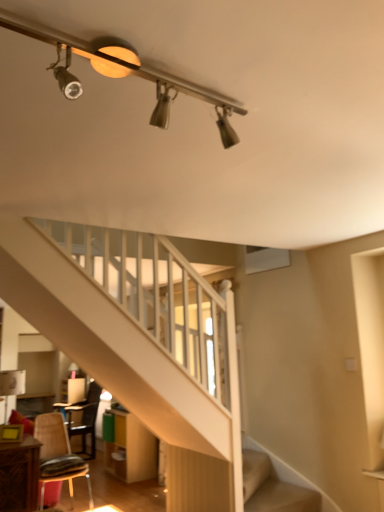
Question: Is metallic brown chair at lower left, which appears as the 1th chair when viewed from the front, turned away from wooden chair at lower left, the 1th chair when ordered from back to front?

Choices:
 (A) no
 (B) yes

Answer: (A)

Question: Is metallic brown chair at lower left, which appears as the 1th chair when viewed from the front, to the right of wooden chair at lower left, the 1th chair when ordered from back to front, from the viewer's perspective?

Choices:
 (A) yes
 (B) no

Answer: (A)

Question: Considering the relative sizes of metallic brown chair at lower left, which is counted as the 2th chair, starting from the back, and wooden chair at lower left, marked as the second chair in a front-to-back arrangement, in the image provided, is metallic brown chair at lower left, which is counted as the 2th chair, starting from the back, smaller than wooden chair at lower left, marked as the second chair in a front-to-back arrangement,?

Choices:
 (A) yes
 (B) no

Answer: (A)

Question: Is metallic brown chair at lower left, which is counted as the 2th chair, starting from the back, at the left side of wooden chair at lower left, the 1th chair when ordered from back to front?

Choices:
 (A) no
 (B) yes

Answer: (A)

Question: Is metallic brown chair at lower left, which appears as the 1th chair when viewed from the front, in front of wooden chair at lower left, marked as the second chair in a front-to-back arrangement?

Choices:
 (A) yes
 (B) no

Answer: (A)

Question: Considering the positions of wooden dresser at lower center and metallic brown chair at lower left, which appears as the 1th chair when viewed from the front, in the image, is wooden dresser at lower center taller or shorter than metallic brown chair at lower left, which appears as the 1th chair when viewed from the front,?

Choices:
 (A) tall
 (B) short

Answer: (B)

Question: Is point (152, 472) positioned closer to the camera than point (48, 430)?

Choices:
 (A) closer
 (B) farther

Answer: (B)

Question: Considering their positions, is wooden dresser at lower center located in front of or behind metallic brown chair at lower left, which is counted as the 2th chair, starting from the back?

Choices:
 (A) front
 (B) behind

Answer: (B)

Question: From the image's perspective, relative to metallic brown chair at lower left, which is counted as the 2th chair, starting from the back, is wooden dresser at lower center above or below?

Choices:
 (A) above
 (B) below

Answer: (B)

Question: Is metallic track lighting at upper center inside or outside of wooden dresser at lower center?

Choices:
 (A) inside
 (B) outside

Answer: (B)

Question: Based on their sizes in the image, would you say metallic track lighting at upper center is bigger or smaller than wooden dresser at lower center?

Choices:
 (A) big
 (B) small

Answer: (B)

Question: Is point (228, 96) closer or farther from the camera than point (132, 425)?

Choices:
 (A) closer
 (B) farther

Answer: (A)

Question: Considering the positions of metallic track lighting at upper center and wooden dresser at lower center in the image, is metallic track lighting at upper center taller or shorter than wooden dresser at lower center?

Choices:
 (A) tall
 (B) short

Answer: (B)

Question: Is metallic brown chair at lower left, which appears as the 1th chair when viewed from the front, in front of or behind wooden dresser at lower center in the image?

Choices:
 (A) behind
 (B) front

Answer: (B)

Question: Visually, is metallic brown chair at lower left, which is counted as the 2th chair, starting from the back, positioned to the left or to the right of wooden dresser at lower center?

Choices:
 (A) left
 (B) right

Answer: (A)